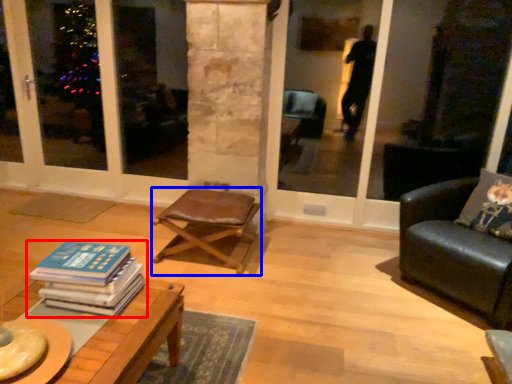
Question: Which of the following is the farthest to the observer, book (highlighted by a red box) or chair (highlighted by a blue box)?

Choices:
 (A) book
 (B) chair

Answer: (B)